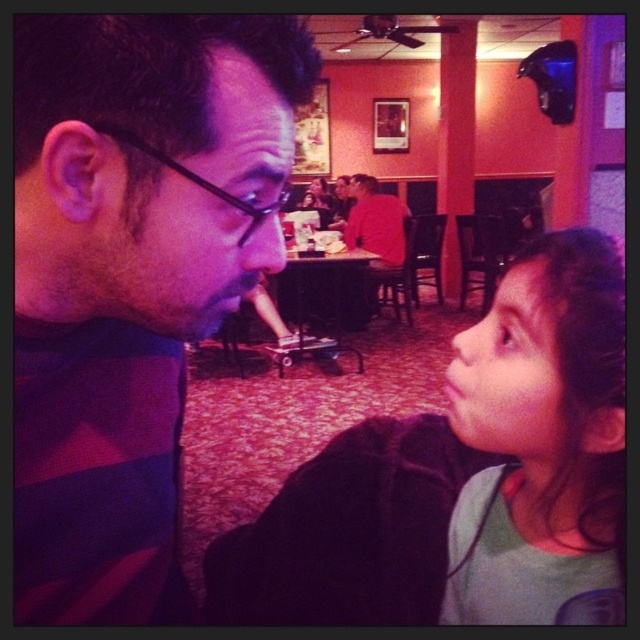
Question: Which is nearer to the matte black jacket at lower right?

Choices:
 (A) light green fabric shirt at right
 (B) matte striped shirt at left

Answer: (A)

Question: Is light green fabric shirt at right closer to camera compared to black plastic glasses at left?

Choices:
 (A) no
 (B) yes

Answer: (A)

Question: Does matte black jacket at lower right lie in front of light green fabric shirt at right?

Choices:
 (A) no
 (B) yes

Answer: (A)

Question: Which point is farther to the camera?

Choices:
 (A) (464, 369)
 (B) (204, 180)
 (C) (115, 515)
 (D) (573, 324)

Answer: (A)

Question: Among these objects, which one is farthest from the camera?

Choices:
 (A) light green fabric shirt at right
 (B) matte black jacket at lower right
 (C) black plastic glasses at left
 (D) matte striped shirt at left

Answer: (B)

Question: Can you confirm if matte striped shirt at left is bigger than light green fabric shirt at right?

Choices:
 (A) yes
 (B) no

Answer: (A)